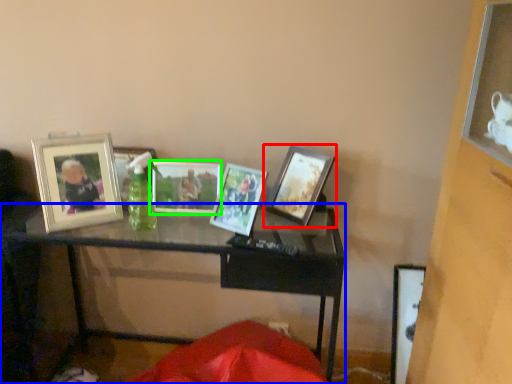
Question: Based on their relative distances, which object is farther from picture frame (highlighted by a red box)? Choose from table (highlighted by a blue box) and picture frame (highlighted by a green box).

Choices:
 (A) table
 (B) picture frame

Answer: (A)